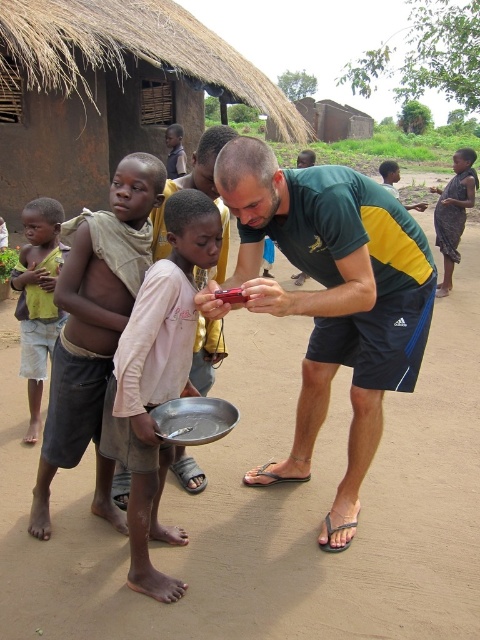
Who is positioned more to the right, green/yellow athletic shirt at center or dark skin boy at center?

dark skin boy at center

Can you confirm if green/yellow athletic shirt at center is smaller than dark skin boy at center?

Yes, green/yellow athletic shirt at center is smaller than dark skin boy at center.

Image resolution: width=480 pixels, height=640 pixels. What do you see at coordinates (333, 300) in the screenshot? I see `green/yellow athletic shirt at center` at bounding box center [333, 300].

The height and width of the screenshot is (640, 480). Identify the location of green/yellow athletic shirt at center. (333, 300).

The height and width of the screenshot is (640, 480). What do you see at coordinates (95, 330) in the screenshot?
I see `light brown skin at center` at bounding box center [95, 330].

Between light brown skin at center and dark brown skin at center, which one is positioned higher?

Positioned higher is dark brown skin at center.

Is point (122, 193) closer to viewer compared to point (445, 243)?

Yes, point (122, 193) is closer to viewer.

Identify the location of light brown skin at center. (95, 330).

Is green/yellow athletic shirt at center positioned in front of light brown skin at center?

Yes.

Between green/yellow athletic shirt at center and light brown skin at center, which one is positioned lower?

light brown skin at center is lower down.

Between point (375, 307) and point (108, 256), which one is positioned behind?

The point (375, 307) is behind.

Find the location of `green/yellow athletic shirt at center`. green/yellow athletic shirt at center is located at coordinates (333, 300).